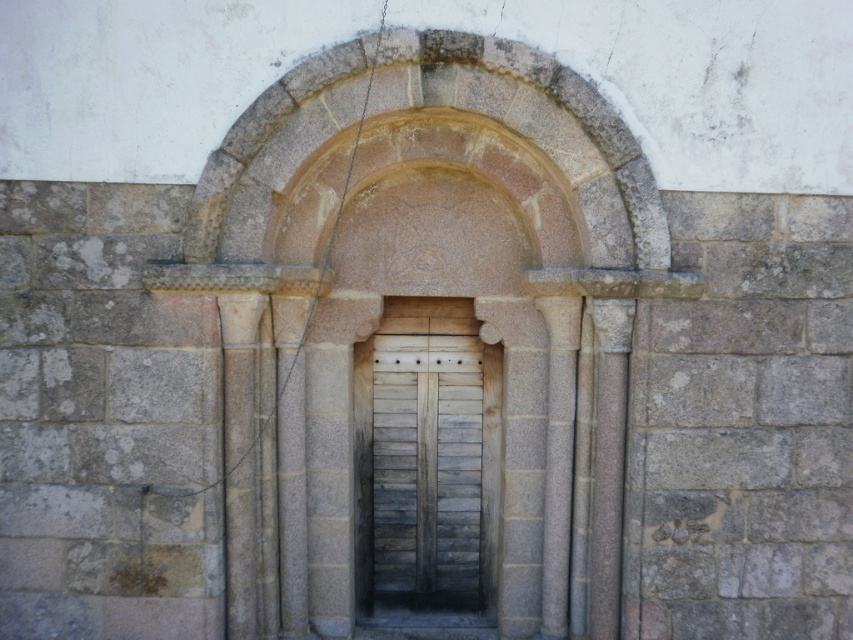
You are an architect examining the stone structure. You notice the stone textured arch at center and the smooth stone pillar at center. Which one has a greater height?

The stone textured arch at center is taller than the smooth stone pillar at center.